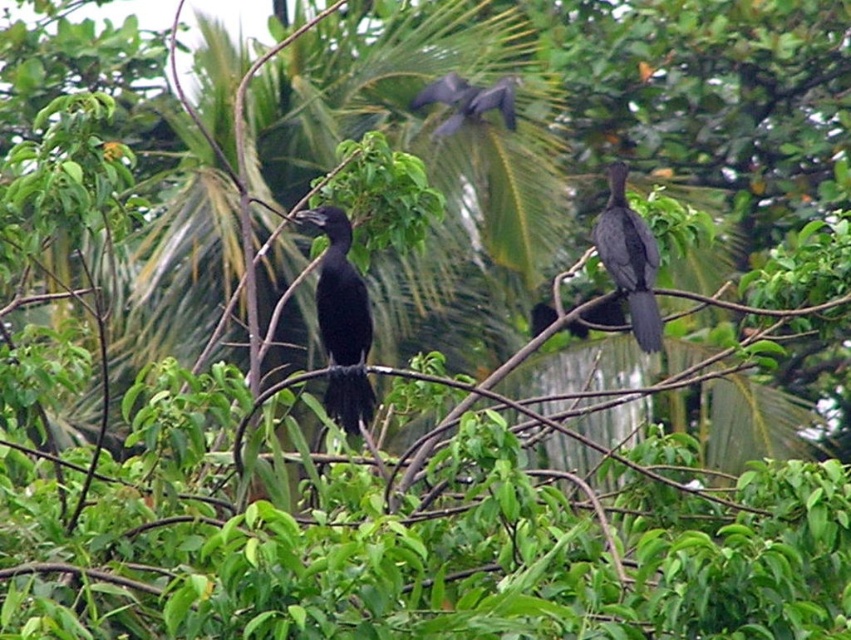
How distant is black matte bird at center from shiny black bird at right?

black matte bird at center and shiny black bird at right are 1.35 meters apart.

Can you confirm if black matte bird at center is positioned below shiny black bird at right?

Indeed, black matte bird at center is positioned under shiny black bird at right.

Does point (366, 378) lie in front of point (650, 330)?

Yes.

At what (x,y) coordinates should I click in order to perform the action: click on black matte bird at center. Please return your answer as a coordinate pair (x, y). Image resolution: width=851 pixels, height=640 pixels. Looking at the image, I should click on (341, 323).

Who is more distant from viewer, [343,257] or [507,76]?

The point [507,76] is behind.

Between point (363, 316) and point (410, 104), which one is positioned behind?

Positioned behind is point (410, 104).

This screenshot has height=640, width=851. In order to click on black matte bird at center in this screenshot , I will do `click(341, 323)`.

Is the position of shiny black bird at right more distant than that of shiny black bird at upper center?

No, shiny black bird at right is in front of shiny black bird at upper center.

Does shiny black bird at right have a lesser width compared to shiny black bird at upper center?

Correct, shiny black bird at right's width is less than shiny black bird at upper center's.

Is point (620, 280) positioned in front of point (443, 132)?

Yes, point (620, 280) is closer to viewer.

Image resolution: width=851 pixels, height=640 pixels. What are the coordinates of `shiny black bird at right` in the screenshot? It's located at (629, 259).